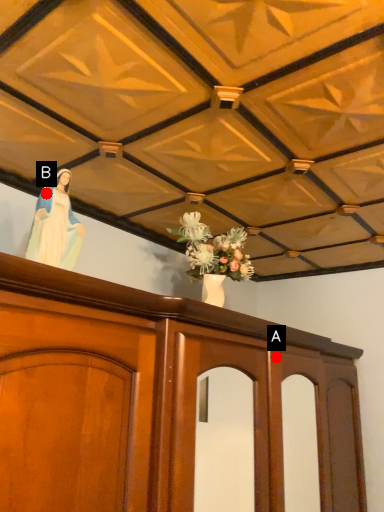
Question: Two points are circled on the image, labeled by A and B beside each circle. Among these points, which one is nearest to the camera?

Choices:
 (A) A is closer
 (B) B is closer

Answer: (B)